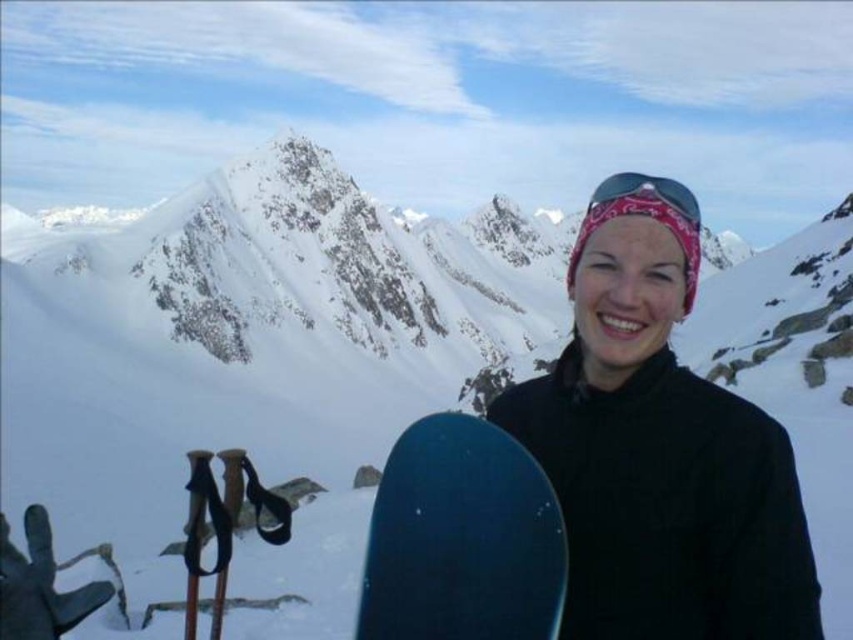
Question: Is blue matte snowboard at center smaller than pink fabric bandana at upper center?

Choices:
 (A) yes
 (B) no

Answer: (A)

Question: Which point is farther to the camera?

Choices:
 (A) (659, 182)
 (B) (627, 481)
 (C) (444, 504)

Answer: (A)

Question: Considering the real-world distances, which object is farthest from the pink fabric bandana at upper center?

Choices:
 (A) matte black snowboard at lower center
 (B) blue matte snowboard at center

Answer: (B)

Question: Is matte black snowboard at lower center to the left of blue matte snowboard at center from the viewer's perspective?

Choices:
 (A) yes
 (B) no

Answer: (B)

Question: Considering the real-world distances, which object is closest to the blue matte snowboard at center?

Choices:
 (A) pink fabric bandana at upper center
 (B) matte black snowboard at lower center

Answer: (B)

Question: Does blue matte snowboard at center appear under pink fabric bandana at upper center?

Choices:
 (A) yes
 (B) no

Answer: (A)